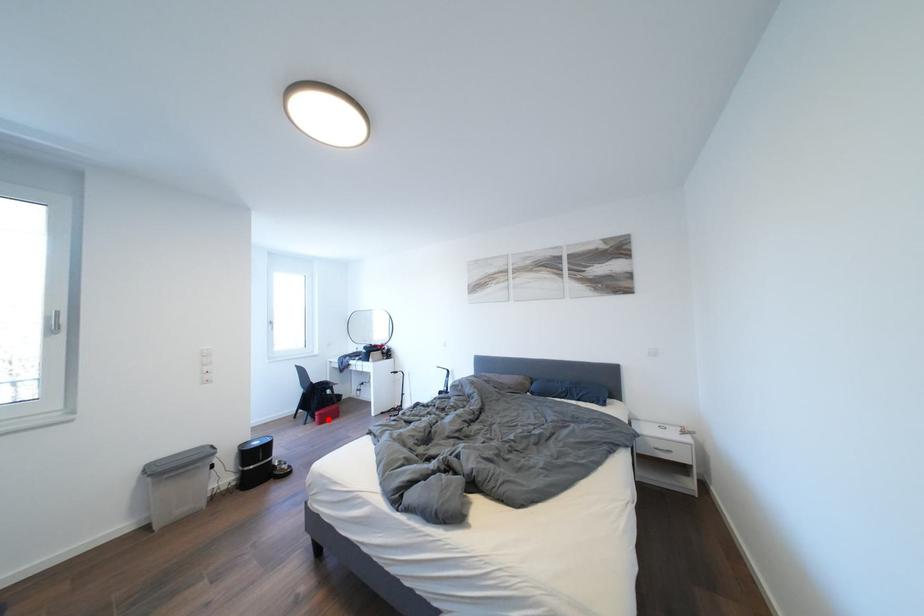
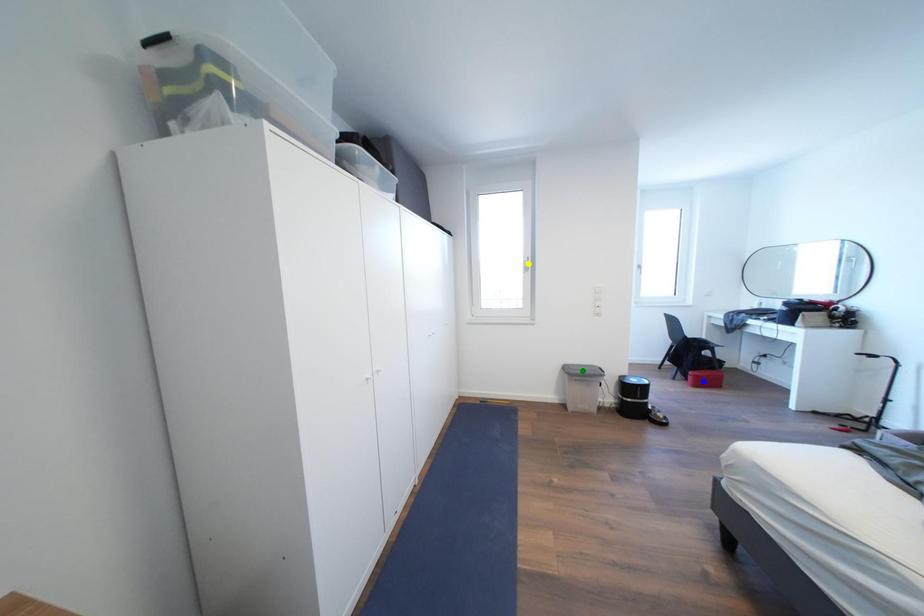
Question: I am providing you with two images of the same scene from different viewpoints. A red point is marked on the first image. You are given multiple points on the second image. Which spot in image 2 lines up with the point in image 1?

Choices:
 (A) yellow point
 (B) blue point
 (C) green point

Answer: (B)